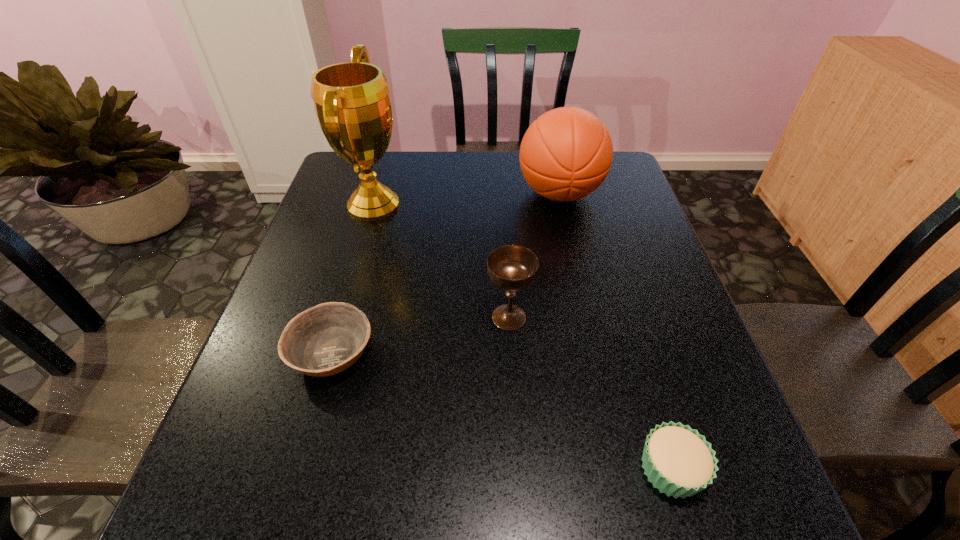
Find the location of a particular element. The width and height of the screenshot is (960, 540). vacant position at the far edge of the desktop is located at coordinates (469, 182).

Locate an element on the screen. free location at the near edge is located at coordinates (641, 494).

The height and width of the screenshot is (540, 960). In the image, there is a desktop. Identify the location of free space at the left edge. (334, 281).

Locate an element on the screen. Image resolution: width=960 pixels, height=540 pixels. free region at the right edge is located at coordinates (620, 337).

In the image, there is a desktop. Identify the location of vacant space at the far left corner. (383, 176).

Image resolution: width=960 pixels, height=540 pixels. In order to click on free location at the near left corner of the desktop in this screenshot , I will do `click(273, 534)`.

Identify the location of vacant region at the far right corner. (611, 191).

Image resolution: width=960 pixels, height=540 pixels. Find the location of `free point at the near right corner`. free point at the near right corner is located at coordinates (734, 512).

In order to click on free area in between the cupcake and the award in this screenshot , I will do `click(522, 337)`.

The height and width of the screenshot is (540, 960). Find the location of `vacant area that lies between the award and the bowl`. vacant area that lies between the award and the bowl is located at coordinates (353, 279).